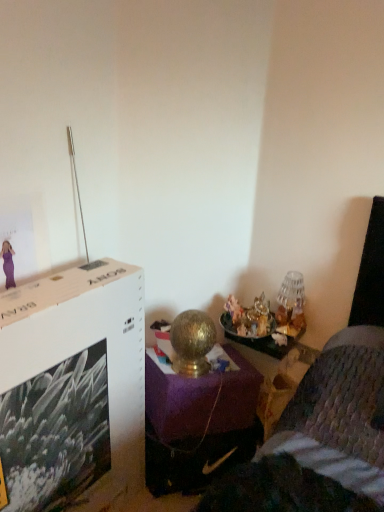
Question: From a real-world perspective, is white cardboard file cabinet at upper left on top of gold metallic table lamp at right?

Choices:
 (A) no
 (B) yes

Answer: (A)

Question: Considering the relative positions of white cardboard file cabinet at upper left and gold metallic table lamp at right in the image provided, is white cardboard file cabinet at upper left to the left of gold metallic table lamp at right from the viewer's perspective?

Choices:
 (A) yes
 (B) no

Answer: (A)

Question: Can you confirm if white cardboard file cabinet at upper left is wider than gold metallic table lamp at right?

Choices:
 (A) no
 (B) yes

Answer: (B)

Question: Is white cardboard file cabinet at upper left closer to camera compared to gold metallic table lamp at right?

Choices:
 (A) no
 (B) yes

Answer: (B)

Question: Can you see white cardboard file cabinet at upper left touching gold metallic table lamp at right?

Choices:
 (A) no
 (B) yes

Answer: (A)

Question: Is gold metallic table at center bigger or smaller than white cardboard file cabinet at upper left?

Choices:
 (A) small
 (B) big

Answer: (A)

Question: Considering the positions of gold metallic table at center and white cardboard file cabinet at upper left in the image, is gold metallic table at center taller or shorter than white cardboard file cabinet at upper left?

Choices:
 (A) tall
 (B) short

Answer: (B)

Question: Looking at their shapes, would you say gold metallic table at center is wider or thinner than white cardboard file cabinet at upper left?

Choices:
 (A) wide
 (B) thin

Answer: (A)

Question: From the image's perspective, is gold metallic table at center located above or below white cardboard file cabinet at upper left?

Choices:
 (A) below
 (B) above

Answer: (B)

Question: Considering their positions, is gold metallic table at center located in front of or behind gold metallic table lamp at right?

Choices:
 (A) front
 (B) behind

Answer: (A)

Question: From the image's perspective, is gold metallic table at center located above or below gold metallic table lamp at right?

Choices:
 (A) above
 (B) below

Answer: (B)

Question: Is gold metallic table at center to the left or to the right of gold metallic table lamp at right in the image?

Choices:
 (A) left
 (B) right

Answer: (A)

Question: Considering the positions of gold metallic table at center and gold metallic table lamp at right in the image, is gold metallic table at center taller or shorter than gold metallic table lamp at right?

Choices:
 (A) short
 (B) tall

Answer: (B)

Question: From their relative heights in the image, would you say white cardboard file cabinet at upper left is taller or shorter than gold metallic table lamp at right?

Choices:
 (A) tall
 (B) short

Answer: (A)

Question: Is white cardboard file cabinet at upper left to the left or to the right of gold metallic table lamp at right in the image?

Choices:
 (A) right
 (B) left

Answer: (B)